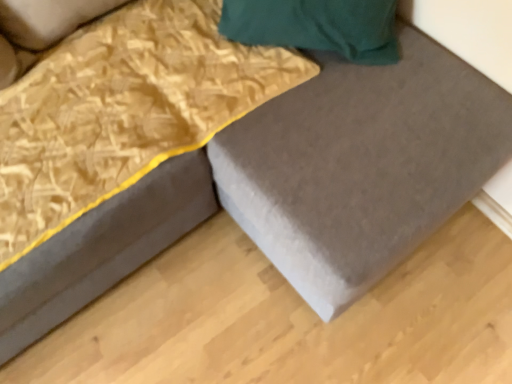
Question: Is gold textured blanket at upper left smaller than matte gray bed frame at lower left?

Choices:
 (A) yes
 (B) no

Answer: (A)

Question: Does gold textured blanket at upper left touch matte gray bed frame at lower left?

Choices:
 (A) no
 (B) yes

Answer: (A)

Question: Does gold textured blanket at upper left have a greater width compared to matte gray bed frame at lower left?

Choices:
 (A) yes
 (B) no

Answer: (B)

Question: Does gold textured blanket at upper left lie behind matte gray bed frame at lower left?

Choices:
 (A) yes
 (B) no

Answer: (A)

Question: Does gold textured blanket at upper left appear on the left side of matte gray bed frame at lower left?

Choices:
 (A) no
 (B) yes

Answer: (A)

Question: Is point (232, 221) closer or farther from the camera than point (254, 62)?

Choices:
 (A) farther
 (B) closer

Answer: (A)

Question: Looking at the image, does matte gray plywood at lower right seem bigger or smaller compared to gold textured blanket at upper left?

Choices:
 (A) big
 (B) small

Answer: (B)

Question: Is matte gray plywood at lower right taller or shorter than gold textured blanket at upper left?

Choices:
 (A) tall
 (B) short

Answer: (B)

Question: Is matte gray plywood at lower right wider or thinner than gold textured blanket at upper left?

Choices:
 (A) thin
 (B) wide

Answer: (B)

Question: Is gold textured blanket at upper left to the left or to the right of matte gray bed frame at lower left in the image?

Choices:
 (A) left
 (B) right

Answer: (B)

Question: Based on their sizes in the image, would you say gold textured blanket at upper left is bigger or smaller than matte gray bed frame at lower left?

Choices:
 (A) big
 (B) small

Answer: (B)

Question: Considering the positions of point tap(196, 129) and point tap(136, 228), is point tap(196, 129) closer or farther from the camera than point tap(136, 228)?

Choices:
 (A) farther
 (B) closer

Answer: (B)

Question: From the image's perspective, is gold textured blanket at upper left positioned above or below matte gray bed frame at lower left?

Choices:
 (A) above
 (B) below

Answer: (A)

Question: Is matte gray bed frame at lower left wider or thinner than gold textured blanket at upper left?

Choices:
 (A) thin
 (B) wide

Answer: (B)

Question: From a real-world perspective, relative to gold textured blanket at upper left, is matte gray bed frame at lower left vertically above or below?

Choices:
 (A) below
 (B) above

Answer: (A)